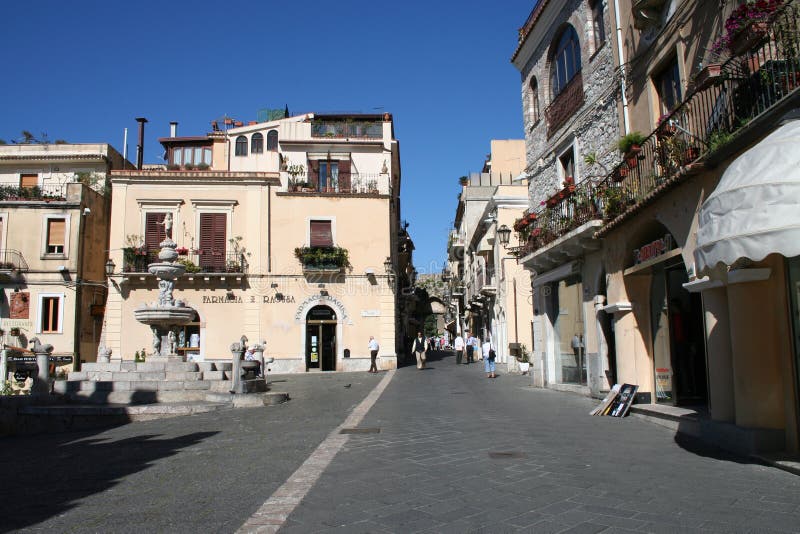
Identify the location of statue. (168, 223).